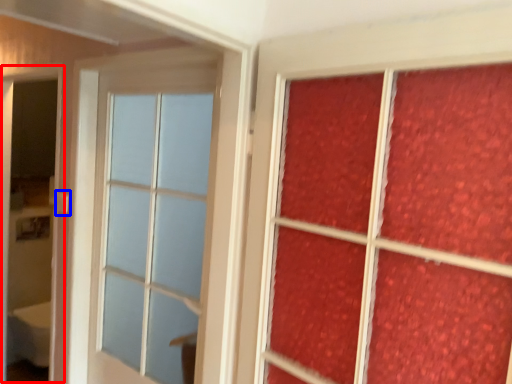
Question: Which point is further to the camera, screen door (highlighted by a red box) or door handle (highlighted by a blue box)?

Choices:
 (A) screen door
 (B) door handle

Answer: (B)